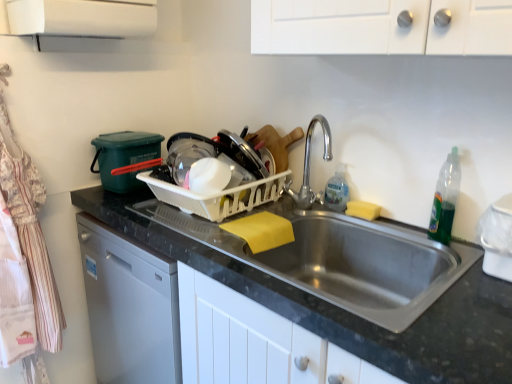
Locate an element on the screen. The height and width of the screenshot is (384, 512). vacant space to the left of clear plastic bottle at sink is located at coordinates click(x=304, y=209).